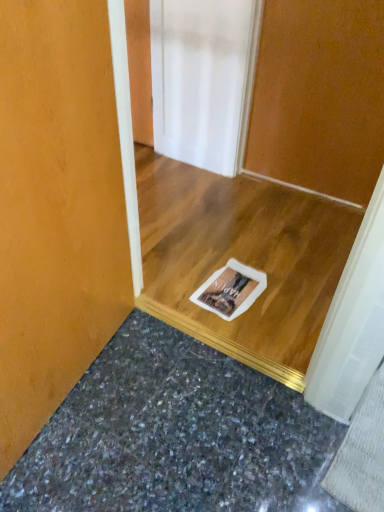
Where is `vacant area on top of granite at lower center (from a real-world perspective)`? The height and width of the screenshot is (512, 384). vacant area on top of granite at lower center (from a real-world perspective) is located at coordinates (161, 435).